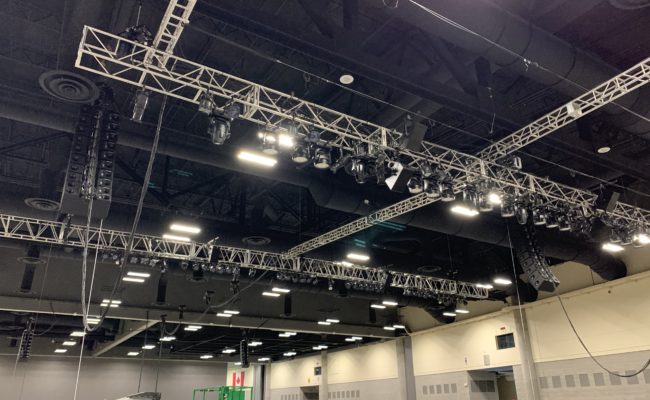
Locate an element on the screen. Image resolution: width=650 pixels, height=400 pixels. support beam is located at coordinates (329, 378), (408, 373), (528, 360).